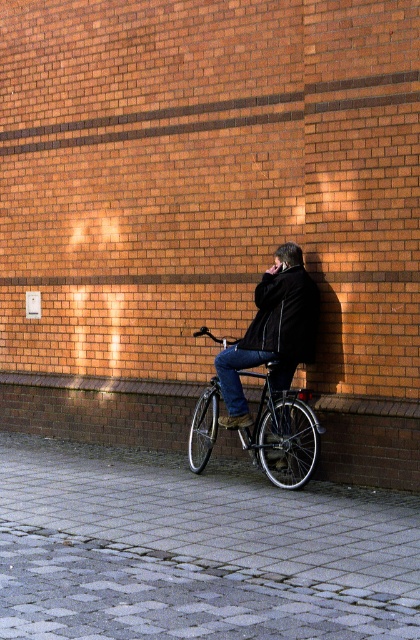
Question: Which point appears closest to the camera in this image?

Choices:
 (A) (310, 304)
 (B) (257, 284)

Answer: (A)

Question: Is gray cobblestone pavement at lower left below shiny metallic bicycle at center?

Choices:
 (A) yes
 (B) no

Answer: (A)

Question: Does gray cobblestone pavement at lower left appear under dark wool coat at center?

Choices:
 (A) no
 (B) yes

Answer: (B)

Question: Which point is farther to the camera?

Choices:
 (A) (154, 611)
 (B) (281, 314)
 (C) (288, 355)

Answer: (B)

Question: Which object is farther from the camera taking this photo?

Choices:
 (A) gray cobblestone pavement at lower left
 (B) black matte jacket at center

Answer: (B)

Question: Can you confirm if gray cobblestone pavement at lower left is wider than dark wool coat at center?

Choices:
 (A) yes
 (B) no

Answer: (A)